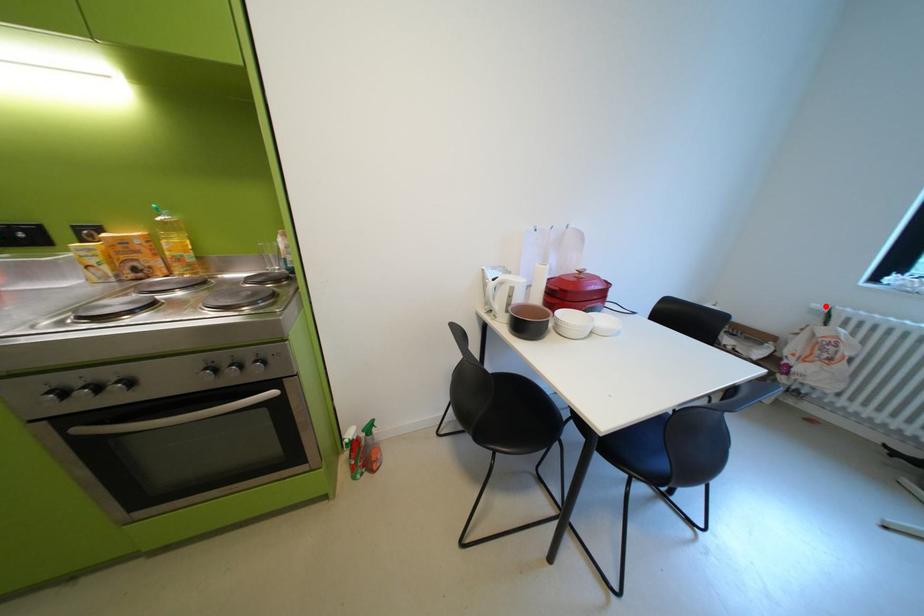
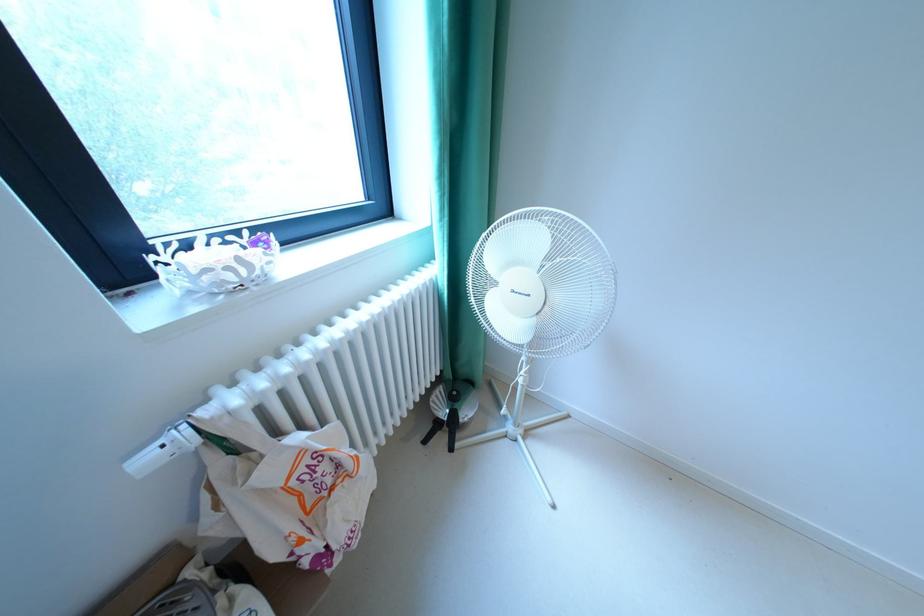
In the second image, find the point that corresponds to the highlighted location in the first image.

(156, 460)